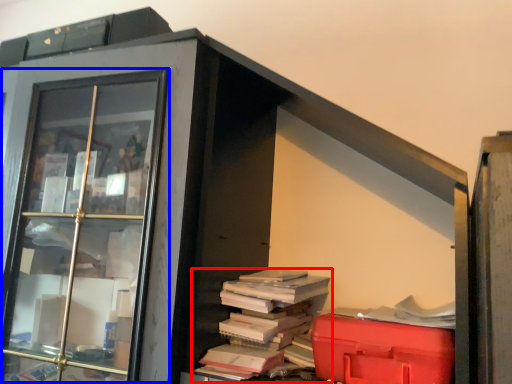
Question: Which of the following is the closest to the observer, book (highlighted by a red box) or glass door (highlighted by a blue box)?

Choices:
 (A) book
 (B) glass door

Answer: (B)